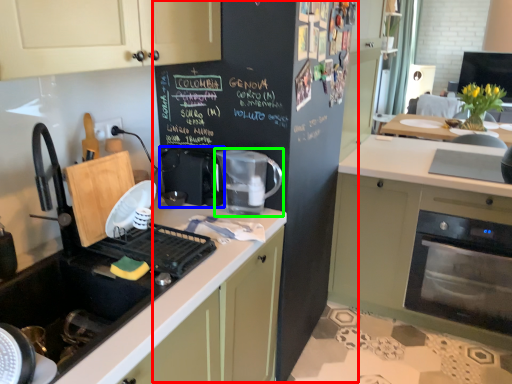
Question: Considering the real-world distances, which object is closest to bulletin board (highlighted by a red box)? coffee machine (highlighted by a blue box) or kitchen appliance (highlighted by a green box).

Choices:
 (A) coffee machine
 (B) kitchen appliance

Answer: (B)